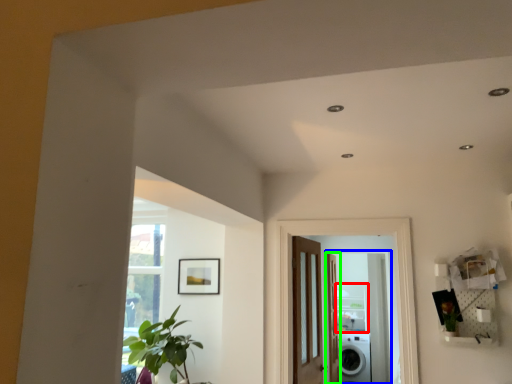
Question: Which object is the farthest from shelf (highlighted by a red box)? Choose among these: screen door (highlighted by a blue box) or door (highlighted by a green box).

Choices:
 (A) screen door
 (B) door

Answer: (B)